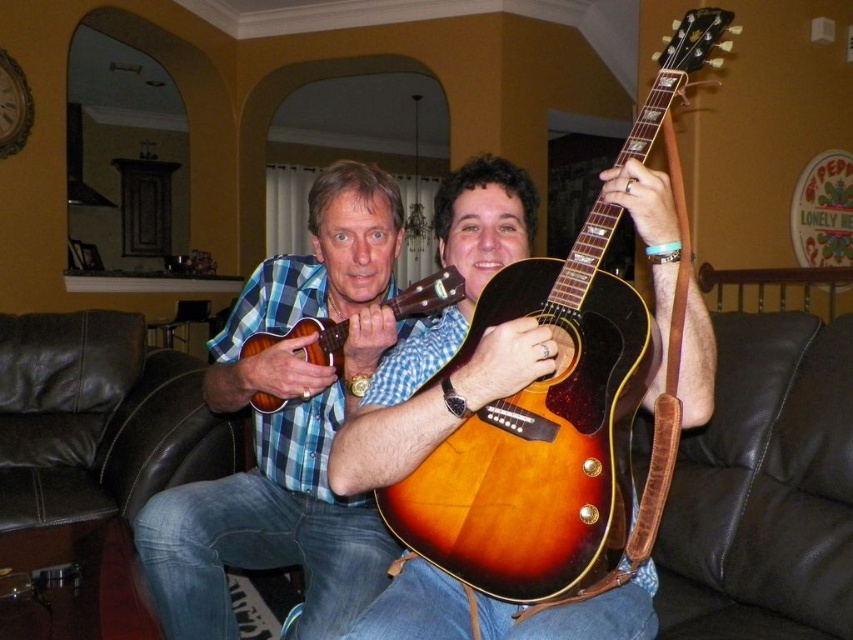
The height and width of the screenshot is (640, 853). Describe the element at coordinates (292, 440) in the screenshot. I see `satin brown guitar at center` at that location.

Does satin brown guitar at center appear under satin wood guitar at center?

Indeed, satin brown guitar at center is positioned under satin wood guitar at center.

Who is more forward, (654, 269) or (608, 500)?

Point (608, 500) is more forward.

Locate an element on the screen. This screenshot has width=853, height=640. satin brown guitar at center is located at coordinates (292, 440).

Does satin wood guitar at center come behind brown leather armchair at right?

That is False.

Is satin wood guitar at center to the right of brown leather armchair at right from the viewer's perspective?

No, satin wood guitar at center is not to the right of brown leather armchair at right.

Which is in front, point (688, 24) or point (833, 548)?

Positioned in front is point (688, 24).

Find the location of a particular element. The width and height of the screenshot is (853, 640). satin wood guitar at center is located at coordinates (546, 440).

Between satin brown guitar at center and brown leather armchair at right, which one has more height?

satin brown guitar at center

Is point (369, 378) farther from camera compared to point (769, 433)?

No, (369, 378) is in front of (769, 433).

The image size is (853, 640). In order to click on satin brown guitar at center in this screenshot , I will do `click(292, 440)`.